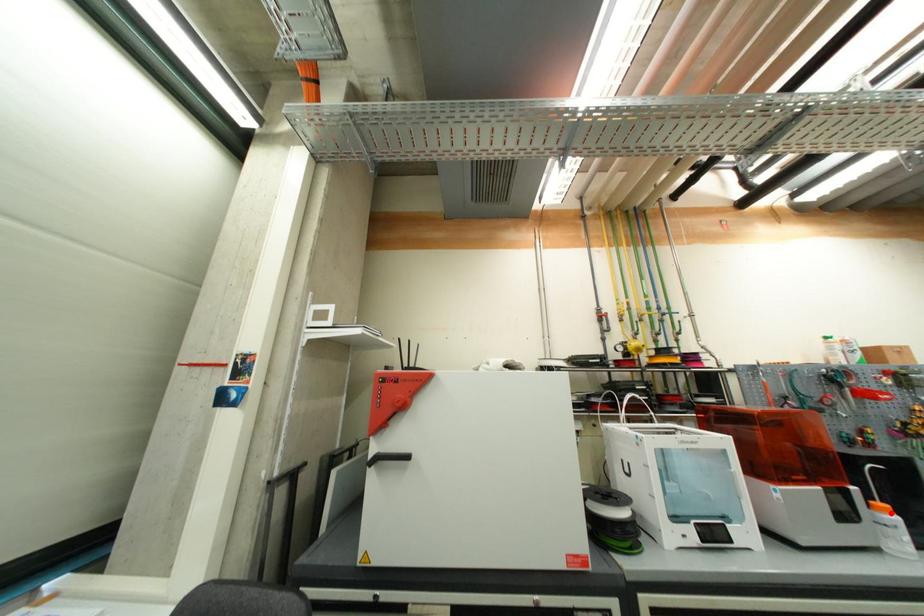
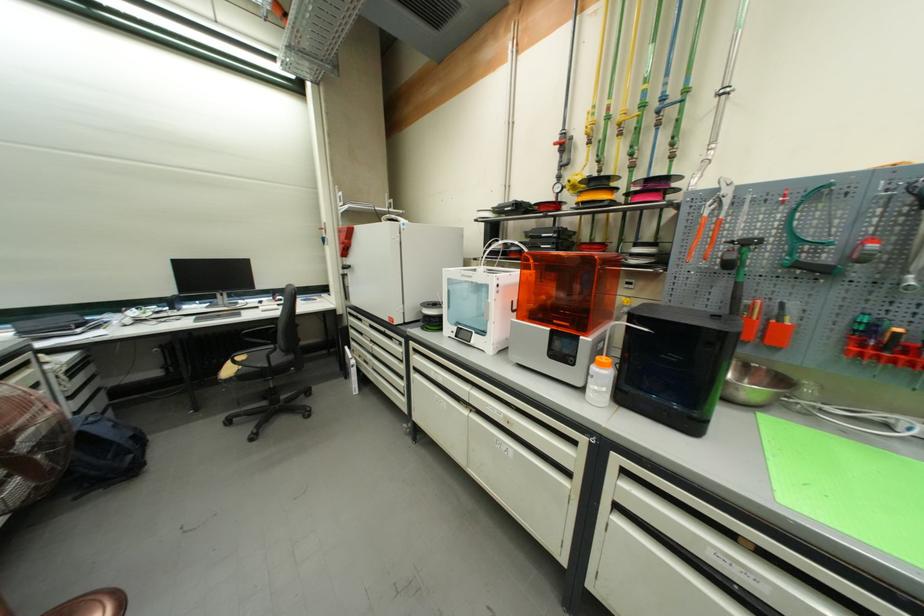
Question: I am providing you with two images of the same scene from different viewpoints. Image1 has a red point marked. In image2, the corresponding 3D location appears at what relative position? Reply with the corresponding letter.

Choices:
 (A) Closer
 (B) Farther

Answer: (B)